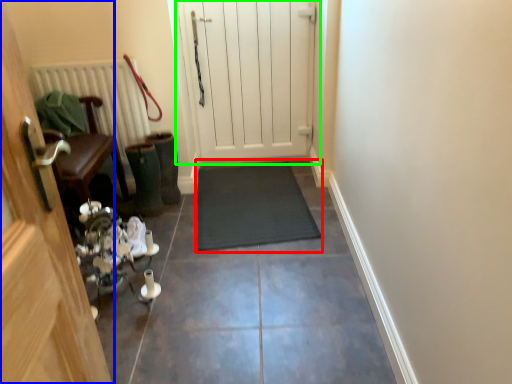
Question: Which is farther away from doormat (highlighted by a red box)? door (highlighted by a blue box) or door (highlighted by a green box)?

Choices:
 (A) door
 (B) door

Answer: (A)